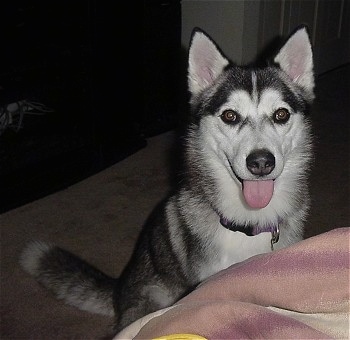
The image size is (350, 340). In order to click on blanket in this screenshot , I will do (x=291, y=266).